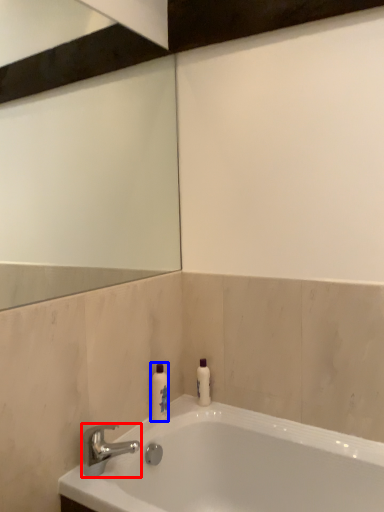
Question: Among these objects, which one is farthest to the camera, tap (highlighted by a red box) or toiletry (highlighted by a blue box)?

Choices:
 (A) tap
 (B) toiletry

Answer: (B)